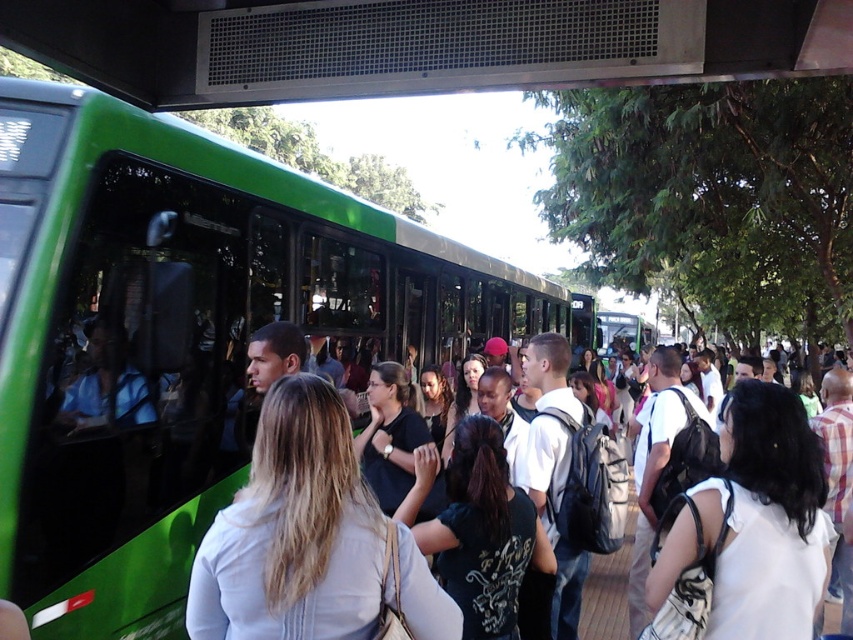
You are standing at the bus stop and want to board the green matte bus at left. Where should you go to find it?

The green matte bus at left is located at point [180,337].

You are a photographer trying to capture a candid shot of the white fabric shirt at center and the matte black backpack at center at the bus stop. Since you want to ensure both are clearly visible in the photo, which object should you focus on to ensure the larger one is in sharp focus?

The white fabric shirt at center is larger in size than the matte black backpack at center, so you should focus on the white fabric shirt at center to ensure it is in sharp focus.

You are a delivery person who needs to place a large package on top of the green matte bus at left and the matte black backpack at center. Which object can the package be placed on?

The green matte bus at left is much taller than the matte black backpack at center, so the package can be placed on the green matte bus at left.